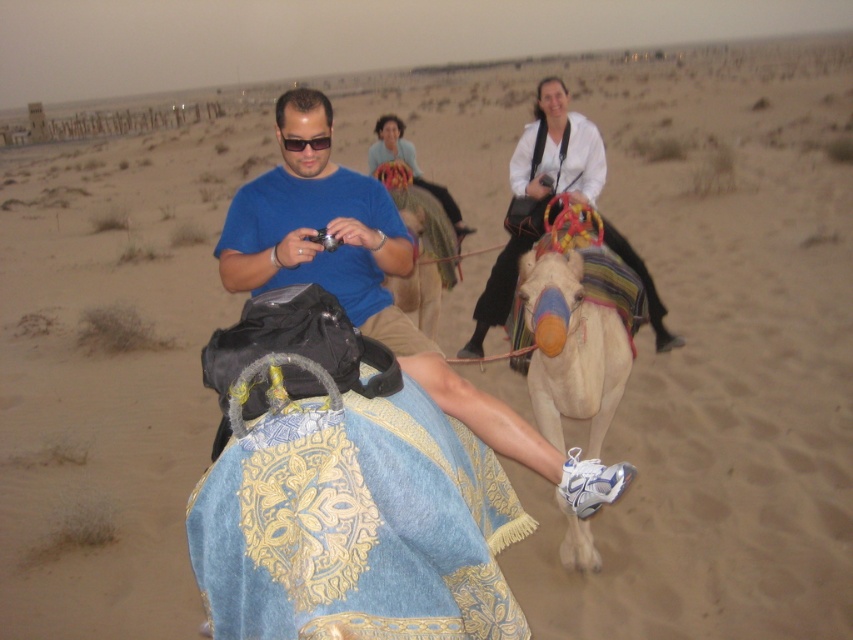
Is blue cotton shirt at center positioned behind white matte shirt at upper center?

No, it is in front of white matte shirt at upper center.

Consider the image. Can you confirm if blue cotton shirt at center is thinner than white matte shirt at upper center?

Indeed, blue cotton shirt at center has a lesser width compared to white matte shirt at upper center.

The image size is (853, 640). What do you see at coordinates (374, 288) in the screenshot?
I see `blue cotton shirt at center` at bounding box center [374, 288].

The width and height of the screenshot is (853, 640). Find the location of `blue cotton shirt at center`. blue cotton shirt at center is located at coordinates (374, 288).

Does white fabric camel at center come in front of light beige fabric camel at center?

That is True.

Locate an element on the screen. white fabric camel at center is located at coordinates (570, 346).

Find the location of a particular element. white fabric camel at center is located at coordinates (570, 346).

You are a GUI agent. You are given a task and a screenshot of the screen. Output one action in this format:
    pyautogui.click(x=<x>, y=<y>)
    Task: Click on the blue woven blanket at lower center
    This screenshot has width=853, height=640.
    Given the screenshot: What is the action you would take?
    pyautogui.click(x=357, y=525)